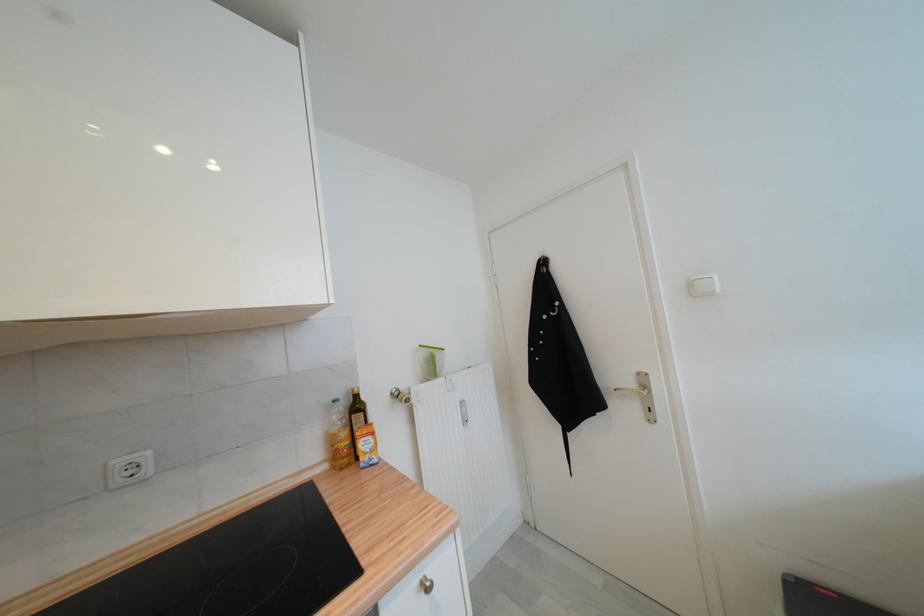
I want to click on metal door handle, so click(641, 395).